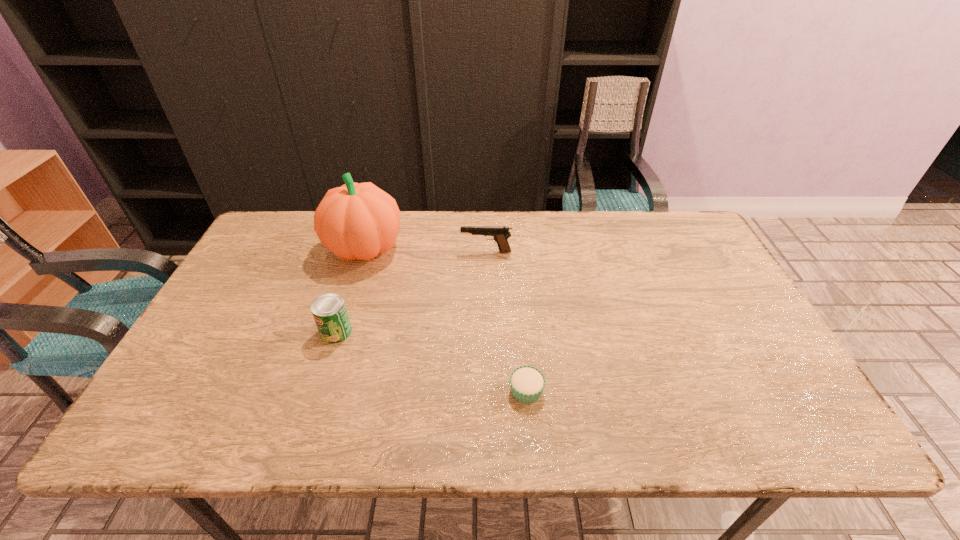
Where is `free region located on the right of the shortest object`? The width and height of the screenshot is (960, 540). free region located on the right of the shortest object is located at coordinates coord(592,390).

The width and height of the screenshot is (960, 540). In order to click on pumpkin that is at the far edge in this screenshot , I will do click(x=358, y=221).

At what (x,y) coordinates should I click in order to perform the action: click on pistol that is positioned at the far edge. Please return your answer as a coordinate pair (x, y). This screenshot has height=540, width=960. Looking at the image, I should click on (500, 234).

The image size is (960, 540). I want to click on object positioned at the near edge, so click(x=527, y=383).

The image size is (960, 540). In order to click on free space at the far edge of the desktop in this screenshot , I will do `click(567, 241)`.

The width and height of the screenshot is (960, 540). In the image, there is a desktop. Identify the location of vacant space at the near edge. tap(318, 435).

In the image, there is a desktop. Where is `vacant space at the left edge`? The width and height of the screenshot is (960, 540). vacant space at the left edge is located at coordinates (213, 314).

The height and width of the screenshot is (540, 960). In the image, there is a desktop. Identify the location of vacant space at the right edge. (740, 386).

Image resolution: width=960 pixels, height=540 pixels. In the image, there is a desktop. What are the coordinates of `vacant space at the far left corner` in the screenshot? It's located at (266, 240).

In the image, there is a desktop. Identify the location of vacant area at the far right corner. (662, 250).